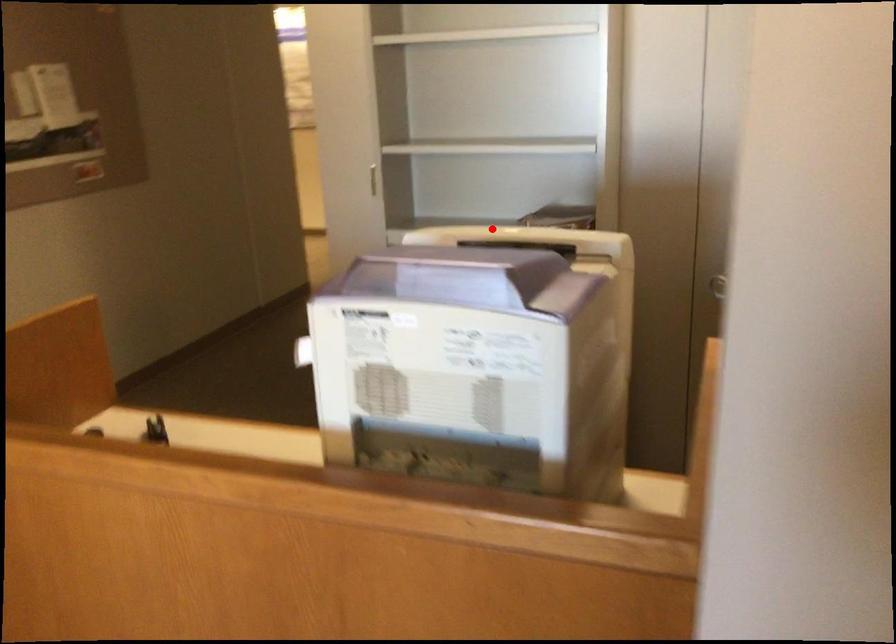
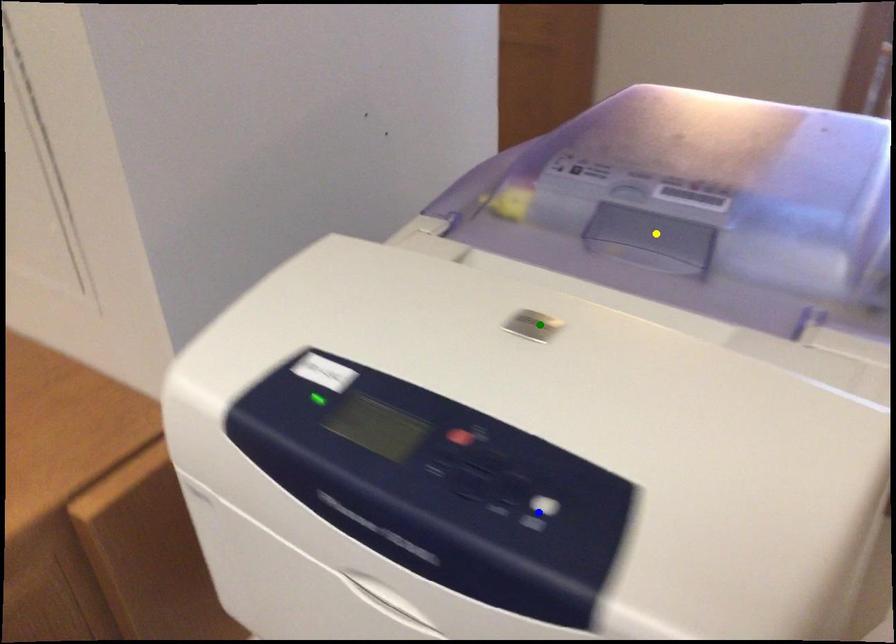
Question: I am providing you with two images of the same scene from different viewpoints. A red point is marked on the first image. You are given multiple points on the second image. Which point in image 2 represents the same 3d spot as the red point in image 1?

Choices:
 (A) green point
 (B) yellow point
 (C) blue point

Answer: (A)